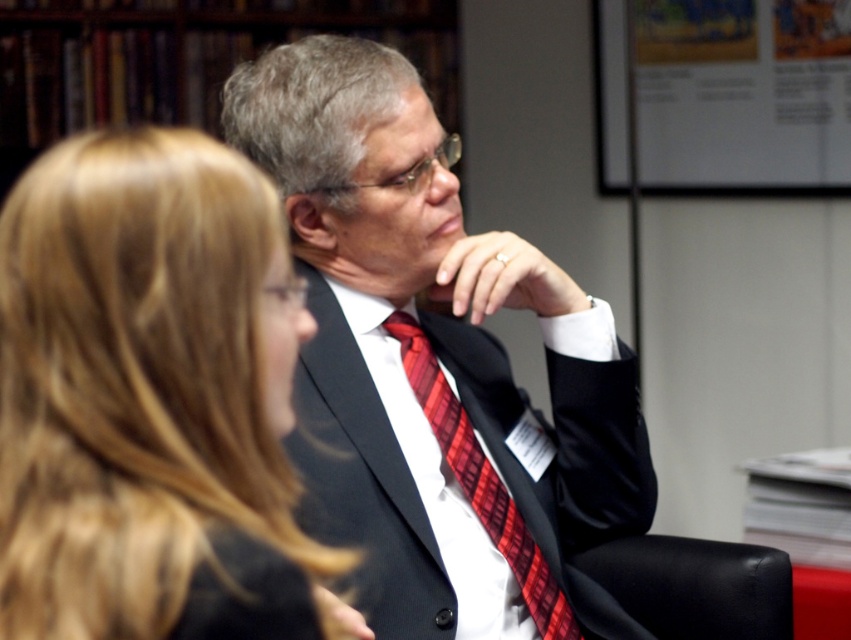
Question: Among these points, which one is nearest to the camera?

Choices:
 (A) (460, 324)
 (B) (256, 236)
 (C) (620, 548)
 (D) (409, 317)

Answer: (B)

Question: Is blonde hair at upper left above black leather chair at lower right?

Choices:
 (A) yes
 (B) no

Answer: (A)

Question: Does matte black suit at center come behind black leather chair at lower right?

Choices:
 (A) no
 (B) yes

Answer: (A)

Question: Which point is farther to the camera?

Choices:
 (A) (398, 324)
 (B) (558, 426)

Answer: (B)

Question: Among these points, which one is nearest to the camera?

Choices:
 (A) click(130, 508)
 (B) click(700, 611)
 (C) click(577, 289)

Answer: (A)

Question: Is matte black suit at center above black leather chair at lower right?

Choices:
 (A) no
 (B) yes

Answer: (B)